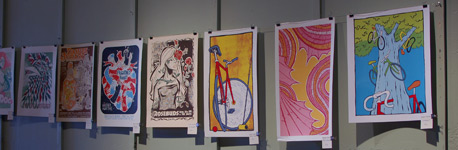
You are a GUI agent. You are given a task and a screenshot of the screen. Output one action in this format:
    pyautogui.click(x=<x>, y=<y>)
    Task: Click on the white border paintings
    Image resolution: width=458 pixels, height=150 pixels.
    Given the screenshot: What is the action you would take?
    click(13, 53), click(39, 49), click(93, 63), click(98, 66), click(149, 65), click(203, 70), click(276, 83), click(352, 88)